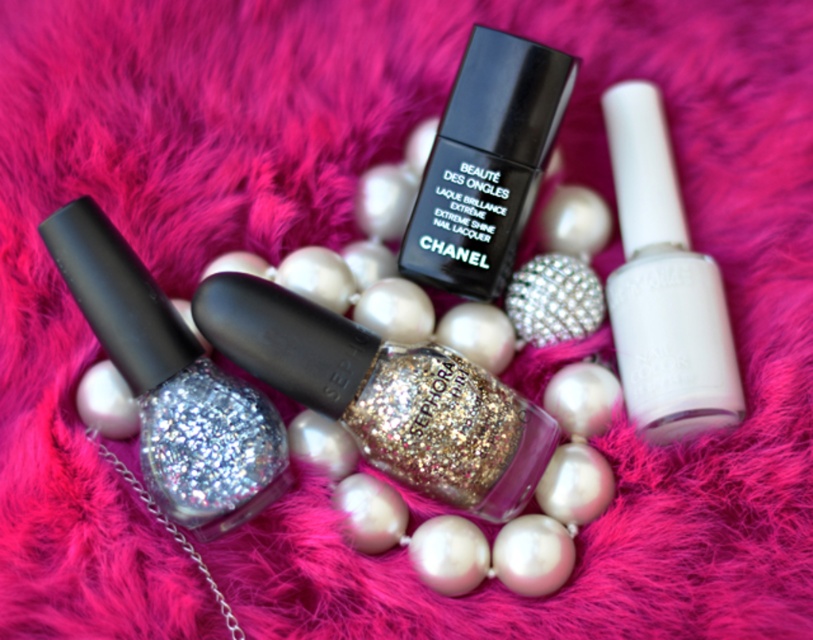
Question: Considering the real-world distances, which object is closest to the black matte nail polish at center?

Choices:
 (A) glittery silver nail polish at center
 (B) white glossy nail polish at upper right

Answer: (B)

Question: Which point is closer to the camera?

Choices:
 (A) (675, 340)
 (B) (548, 54)

Answer: (B)

Question: Is glittery metallic nail polish at center below black matte nail polish at center?

Choices:
 (A) yes
 (B) no

Answer: (A)

Question: Does white glossy nail polish at upper right have a lesser width compared to black matte nail polish at center?

Choices:
 (A) yes
 (B) no

Answer: (A)

Question: Based on their relative distances, which object is nearer to the black matte nail polish at center?

Choices:
 (A) white glossy nail polish at upper right
 (B) glittery metallic nail polish at center

Answer: (A)

Question: Is glittery metallic nail polish at center to the right of white glossy nail polish at upper right from the viewer's perspective?

Choices:
 (A) no
 (B) yes

Answer: (A)